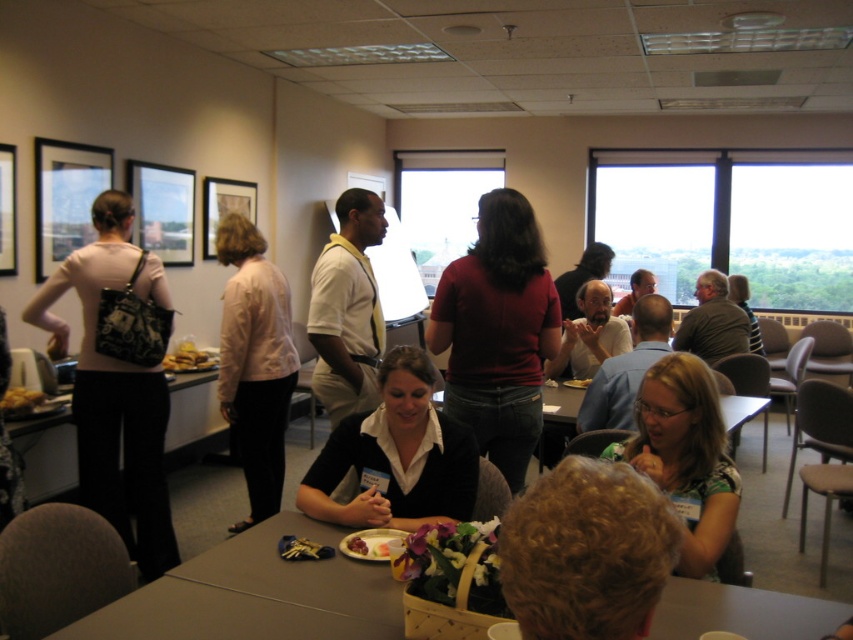
Which is above, matte red shirt at center or matte black shirt at upper right?

matte black shirt at upper right is above.

Looking at this image, can you confirm if matte red shirt at center is shorter than matte black shirt at upper right?

No.

Who is more distant from viewer, (540, 300) or (756, 317)?

The point (756, 317) is more distant.

The width and height of the screenshot is (853, 640). I want to click on matte red shirt at center, so click(x=498, y=332).

Does matte red shirt at center appear under golden crispy bread at lower left?

Incorrect, matte red shirt at center is not positioned below golden crispy bread at lower left.

Can you confirm if matte red shirt at center is thinner than golden crispy bread at lower left?

No, matte red shirt at center is not thinner than golden crispy bread at lower left.

Between point (496, 209) and point (204, 355), which one is positioned behind?

The point (204, 355) is behind.

You are a GUI agent. You are given a task and a screenshot of the screen. Output one action in this format:
    pyautogui.click(x=<x>, y=<y>)
    Task: Click on the matte red shirt at center
    
    Given the screenshot: What is the action you would take?
    pyautogui.click(x=498, y=332)

Who is lower down, matte green shirt at center or matte black shirt at upper right?

Positioned lower is matte green shirt at center.

Is point (668, 419) more distant than point (746, 291)?

No, (668, 419) is in front of (746, 291).

You are a GUI agent. You are given a task and a screenshot of the screen. Output one action in this format:
    pyautogui.click(x=<x>, y=<y>)
    Task: Click on the matte green shirt at center
    This screenshot has height=640, width=853.
    Given the screenshot: What is the action you would take?
    (x=685, y=456)